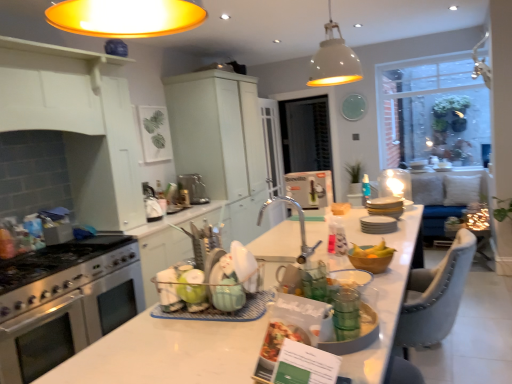
What do you see at coordinates (481, 64) in the screenshot?
I see `metallic silver faucet at upper center` at bounding box center [481, 64].

Locate an element on the screen. The height and width of the screenshot is (384, 512). metallic silver faucet at upper center is located at coordinates (481, 64).

How much space does white glossy cabinet at upper left, marked as the first cabinetry in a front-to-back arrangement, occupy vertically?

The height of white glossy cabinet at upper left, marked as the first cabinetry in a front-to-back arrangement, is 4.01 feet.

Measure the distance between point (378, 269) and camera.

A distance of 5.79 feet exists between point (378, 269) and camera.

This screenshot has height=384, width=512. What do you see at coordinates (346, 314) in the screenshot? I see `green glass cups at center, which is the 2th tableware from right to left` at bounding box center [346, 314].

The height and width of the screenshot is (384, 512). What are the coordinates of `clear glass window screen at center, which appears as the first window screen when viewed from the left` in the screenshot? It's located at (306, 134).

Is there a large distance between green glass cups at center, which is the first tableware from bottom to top, and white glossy cabinet at upper left, marked as the first cabinetry in a front-to-back arrangement?

Yes, green glass cups at center, which is the first tableware from bottom to top, is far from white glossy cabinet at upper left, marked as the first cabinetry in a front-to-back arrangement.

Which object is further away from the camera, green glass cups at center, the 1th tableware from the front, or white glossy cabinet at upper left, the 2th cabinetry in the back-to-front sequence?

white glossy cabinet at upper left, the 2th cabinetry in the back-to-front sequence, is behind.

Is green glass cups at center, which appears as the second tableware when viewed from the back, at the left side of white glossy cabinet at upper left, which is counted as the second cabinetry, starting from the right?

No, green glass cups at center, which appears as the second tableware when viewed from the back, is not to the left of white glossy cabinet at upper left, which is counted as the second cabinetry, starting from the right.

Is green glass cups at center, which appears as the second tableware when viewed from the back, bigger than white glossy cabinet at upper left, marked as the first cabinetry in a front-to-back arrangement?

Actually, green glass cups at center, which appears as the second tableware when viewed from the back, might be smaller than white glossy cabinet at upper left, marked as the first cabinetry in a front-to-back arrangement.

Is clear glass window at upper right, arranged as the second window screen when viewed from the left, positioned behind stainless steel gas stove at left?

Yes.

In the scene shown: Which point is more distant from viewer, [476,78] or [59,245]?

The point [476,78] is farther from the camera.

Which object is wider, clear glass window at upper right, arranged as the second window screen when viewed from the left, or stainless steel gas stove at left?

stainless steel gas stove at left is wider.

In the scene shown: From the image's perspective, is white glossy cabinet at upper left, the 2th cabinetry in the back-to-front sequence, above or below white matte pendant lamp at upper center?

From the image's perspective, white glossy cabinet at upper left, the 2th cabinetry in the back-to-front sequence, appears below white matte pendant lamp at upper center.

Considering the sizes of objects white glossy cabinet at upper left, marked as the first cabinetry in a front-to-back arrangement, and white matte pendant lamp at upper center in the image provided, who is taller, white glossy cabinet at upper left, marked as the first cabinetry in a front-to-back arrangement, or white matte pendant lamp at upper center?

With more height is white glossy cabinet at upper left, marked as the first cabinetry in a front-to-back arrangement.

Which is more distant, (106,227) or (335,79)?

The point (335,79) is more distant.

Considering the relative positions of stainless steel oven at left and white glossy plates at center, which is the first tableware from right to left, in the image provided, is stainless steel oven at left to the left of white glossy plates at center, which is the first tableware from right to left, from the viewer's perspective?

Correct, you'll find stainless steel oven at left to the left of white glossy plates at center, which is the first tableware from right to left.

Looking at this image, from the image's perspective, which one is positioned higher, stainless steel oven at left or white glossy plates at center, placed as the 1th tableware when sorted from top to bottom?

white glossy plates at center, placed as the 1th tableware when sorted from top to bottom, is shown above in the image.

Is stainless steel oven at left taller or shorter than white glossy plates at center, placed as the 1th tableware when sorted from top to bottom?

stainless steel oven at left is taller than white glossy plates at center, placed as the 1th tableware when sorted from top to bottom.

Between stainless steel oven at left and white glossy plates at center, which is the first tableware from right to left, which one has smaller width?

white glossy plates at center, which is the first tableware from right to left, is thinner.

From the picture: Considering the relative sizes of stainless steel gas stove at left and clear glass window screen at center, the 2th window screen when ordered from front to back, in the image provided, is stainless steel gas stove at left shorter than clear glass window screen at center, the 2th window screen when ordered from front to back,?

Yes.

From a real-world perspective, is stainless steel gas stove at left on clear glass window screen at center, which appears as the first window screen when viewed from the left?

No, from a real-world perspective, stainless steel gas stove at left is not above clear glass window screen at center, which appears as the first window screen when viewed from the left.

Would you say stainless steel gas stove at left contains clear glass window screen at center, the first window screen positioned from the back?

No, clear glass window screen at center, the first window screen positioned from the back, is not inside stainless steel gas stove at left.

Between stainless steel gas stove at left and clear glass window screen at center, which appears as the first window screen when viewed from the left, which one has smaller size?

stainless steel gas stove at left is smaller.

Consider the image. Which object is thinner, stainless steel gas stove at left or stainless steel oven at left?

With smaller width is stainless steel oven at left.

Is stainless steel gas stove at left at the left side of stainless steel oven at left?

Yes.

Can you confirm if stainless steel gas stove at left is smaller than stainless steel oven at left?

Yes, stainless steel gas stove at left is smaller than stainless steel oven at left.

This screenshot has width=512, height=384. What are the coordinates of `kitchen appliance that is below the stainless steel gas stove at left (from the image's perspective)` in the screenshot? It's located at (65, 302).

Considering the relative positions of blue plastic spray bottle at center and stainless steel oven at left in the image provided, is blue plastic spray bottle at center in front of stainless steel oven at left?

No, blue plastic spray bottle at center is further to the viewer.

Which of these two, blue plastic spray bottle at center or stainless steel oven at left, is bigger?

Bigger between the two is stainless steel oven at left.

Considering the relative sizes of blue plastic spray bottle at center and stainless steel oven at left in the image provided, is blue plastic spray bottle at center shorter than stainless steel oven at left?

Indeed, blue plastic spray bottle at center has a lesser height compared to stainless steel oven at left.

Which is closer to the camera, (362, 193) or (57, 315)?

Clearly, point (362, 193) is more distant from the camera than point (57, 315).

I want to click on the 1st cabinetry behind the green glass cups at center, which is the first tableware from bottom to top, starting your count from the anchor, so click(x=106, y=165).

Locate an element on the screen. gas stove that appears in front of the clear glass window at upper right, which is counted as the first window screen, starting from the right is located at coordinates (54, 260).

From the picture: Looking at the image, which one is located closer to white matte pendant lamp at upper center, satin nickel kettle at center, positioned as the second appliance in right-to-left order, or clear glass window screen at center, the 2th window screen when ordered from front to back?

satin nickel kettle at center, positioned as the second appliance in right-to-left order, is closer to white matte pendant lamp at upper center.

In the scene shown: Considering their positions, is stainless steel oven at left positioned further to clear glass window screen at center, which appears as the 2th window screen when viewed from the right, than metallic silver faucet at upper center?

stainless steel oven at left is positioned further to the anchor clear glass window screen at center, which appears as the 2th window screen when viewed from the right.

When comparing their distances from clear glass window at upper right, arranged as the second window screen when viewed from the left, does stainless steel oven at left or wooden bowl at center seem further?

Among the two, wooden bowl at center is located further to clear glass window at upper right, arranged as the second window screen when viewed from the left.

Considering their positions, is white glossy plates at center, which is the 2th tableware from front to back, positioned closer to matte green glass at center than stainless steel gas stove at left?

Among the two, white glossy plates at center, which is the 2th tableware from front to back, is located nearer to matte green glass at center.

Estimate the real-world distances between objects in this image. Which object is further from green glass cups at center, which is the 2th tableware from right to left, clear glass window screen at center, which appears as the 2th window screen when viewed from the right, or metallic silver faucet at upper center?

metallic silver faucet at upper center is positioned further to the anchor green glass cups at center, which is the 2th tableware from right to left.

Based on their spatial positions, is matte white cabinet at upper center, arranged as the second cabinetry when viewed from the front, or clear glass window at upper right, arranged as the second window screen when viewed from the left, further from white matte pendant lamp at upper center?

clear glass window at upper right, arranged as the second window screen when viewed from the left, lies further to white matte pendant lamp at upper center than the other object.

Which object lies nearer to the anchor point clear glass window screen at center, which appears as the 2th window screen when viewed from the right, metallic silver faucet at upper center or blue plastic spray bottle at center?

Based on the image, blue plastic spray bottle at center appears to be nearer to clear glass window screen at center, which appears as the 2th window screen when viewed from the right.

Based on their spatial positions, is white glossy plates at center, the 2th appliance when ordered from left to right, or matte white cabinet at upper center, which is counted as the 1th cabinetry, starting from the right, closer to stainless steel oven at left?

Based on the image, white glossy plates at center, the 2th appliance when ordered from left to right, appears to be nearer to stainless steel oven at left.

At what (x,y) coordinates should I click in order to perform the action: click on light fixture located between green glass cups at center, which is the 2th tableware from right to left, and satin nickel kettle at center, positioned as the second appliance in right-to-left order, in the depth direction. Please return your answer as a coordinate pair (x, y). Looking at the image, I should click on (333, 60).

Find the location of a particular element. kitchen appliance between stainless steel gas stove at left and satin nickel kettle at center, positioned as the 1th appliance in left-to-right order, in the front-back direction is located at coordinates (65, 302).

Locate an element on the screen. mixing bowl between matte green glass at center and clear glass window at upper right, the first window screen positioned from the front, along the z-axis is located at coordinates (370, 263).

This screenshot has height=384, width=512. What are the coordinates of `window screen between white glossy cabinet at upper left, which ranks as the 1th cabinetry in left-to-right order, and clear glass window at upper right, the first window screen positioned from the front` in the screenshot? It's located at (306, 134).